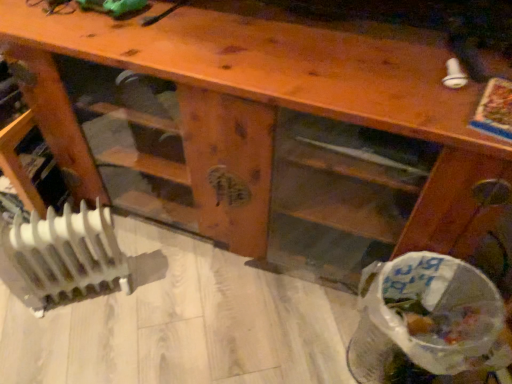
The width and height of the screenshot is (512, 384). Describe the element at coordinates (61, 255) in the screenshot. I see `white plastic radiator at lower left` at that location.

Locate an element on the screen. This screenshot has width=512, height=384. white plastic radiator at lower left is located at coordinates (61, 255).

Identify the location of white plastic radiator at lower left. (61, 255).